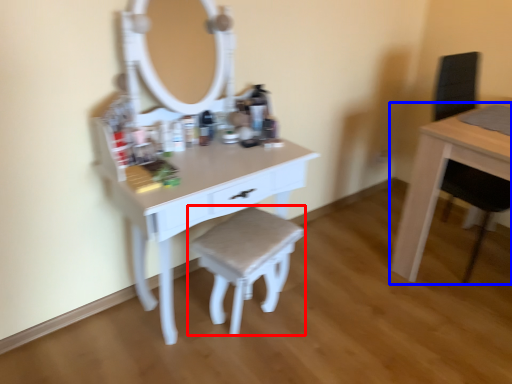
Question: Which object is further to the camera taking this photo, stool (highlighted by a red box) or table (highlighted by a blue box)?

Choices:
 (A) stool
 (B) table

Answer: (B)